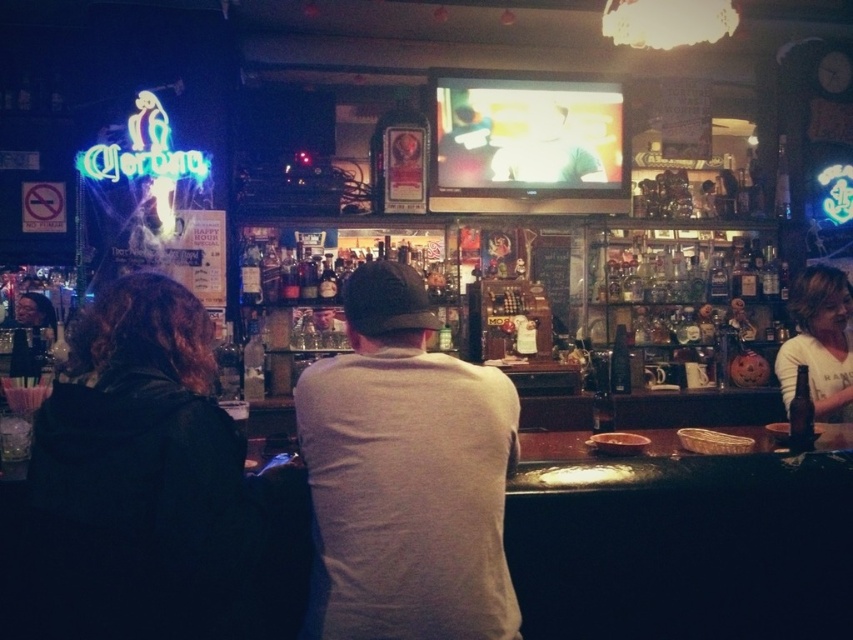
Question: Considering the real-world distances, which object is closest to the white cotton shirt at center?

Choices:
 (A) dark gray hoodie at center
 (B) light brown hair at right

Answer: (A)

Question: Does black leather jacket at left have a smaller size compared to light brown hair at right?

Choices:
 (A) yes
 (B) no

Answer: (B)

Question: Observing the image, what is the correct spatial positioning of dark gray hoodie at center in reference to black leather jacket at left?

Choices:
 (A) right
 (B) left

Answer: (A)

Question: Among these objects, which one is farthest from the camera?

Choices:
 (A) light brown hair at right
 (B) black leather jacket at left

Answer: (A)

Question: Is the position of dark gray hoodie at center more distant than that of black leather jacket at left?

Choices:
 (A) no
 (B) yes

Answer: (B)

Question: Which object is closer to the camera taking this photo?

Choices:
 (A) black leather jacket at left
 (B) dark gray hoodie at center

Answer: (A)